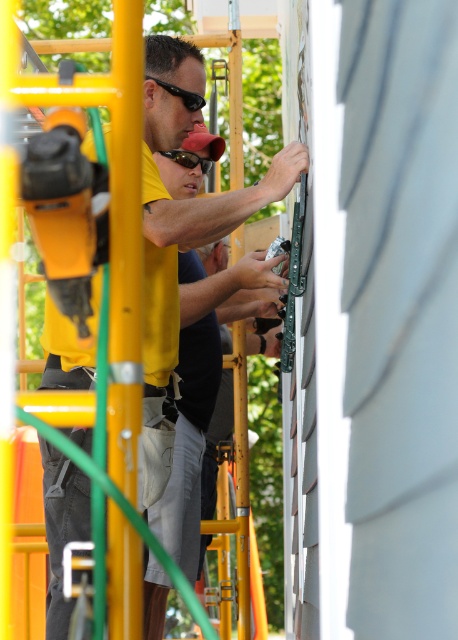
Who is lower down, black plastic goggles at center or black plastic goggles at upper center?

black plastic goggles at center is lower down.

Between point (210, 160) and point (185, 100), which one is positioned behind?

Positioned behind is point (210, 160).

The width and height of the screenshot is (458, 640). In order to click on black plastic goggles at center in this screenshot , I will do `click(189, 160)`.

This screenshot has height=640, width=458. I want to click on yellow matte shirt at center, so click(x=241, y=140).

The height and width of the screenshot is (640, 458). In order to click on yellow matte shirt at center in this screenshot , I will do `click(241, 140)`.

I want to click on yellow matte shirt at center, so click(241, 140).

Is point (259, 342) positioned behind point (201, 172)?

Yes, it is.

How much distance is there between yellow matte shirt at center and black plastic goggles at center?

yellow matte shirt at center and black plastic goggles at center are 1.23 meters apart from each other.

Who is more distant from viewer, (190, 436) or (201, 164)?

The point (201, 164) is behind.

Locate an element on the screen. Image resolution: width=458 pixels, height=640 pixels. yellow matte shirt at center is located at coordinates (241, 140).